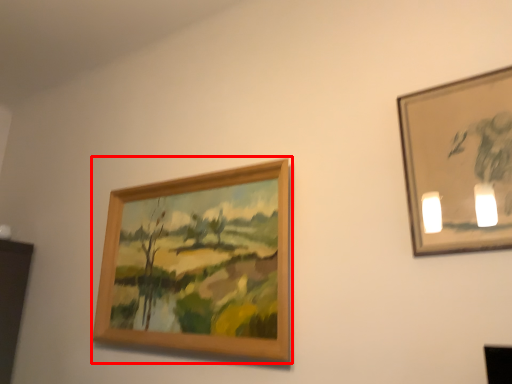
Question: From the image's perspective, considering the relative positions of picture frame (annotated by the red box) and picture frame in the image provided, where is picture frame (annotated by the red box) located with respect to the staircase?

Choices:
 (A) below
 (B) above

Answer: (A)